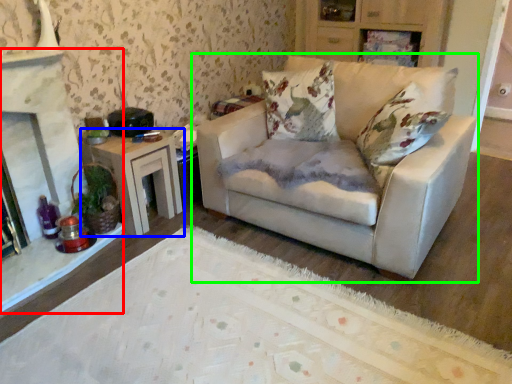
Question: Which is farther away from fireplace (highlighted by a red box)? table (highlighted by a blue box) or studio couch (highlighted by a green box)?

Choices:
 (A) table
 (B) studio couch

Answer: (B)